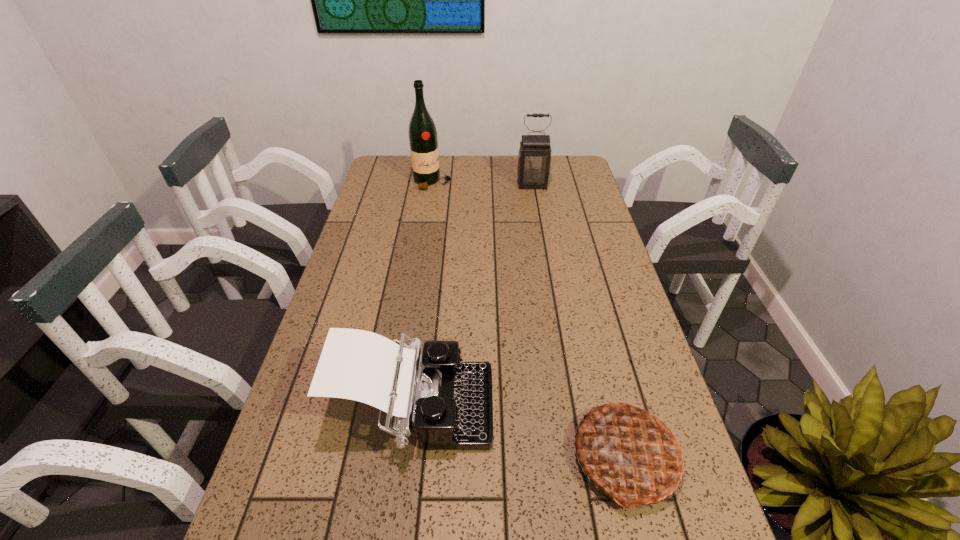
Image resolution: width=960 pixels, height=540 pixels. Find the location of `free space between the typewriter and the wine bottle`. free space between the typewriter and the wine bottle is located at coordinates pyautogui.click(x=423, y=296).

Locate an element on the screen. The width and height of the screenshot is (960, 540). the closest object to the tallest object is located at coordinates (534, 159).

Identify which object is the nearest to the typewriter. Please provide its 2D coordinates. Your answer should be formatted as a tuple, i.e. [(x, y)], where the tuple contains the x and y coordinates of a point satisfying the conditions above.

[(627, 451)]

Identify the location of vacant space that satisfies the following two spatial constraints: 1. on the keys of the pie; 2. on the right side of the typewriter. Image resolution: width=960 pixels, height=540 pixels. (409, 458).

I want to click on free space that satisfies the following two spatial constraints: 1. on the front-facing side of the lantern; 2. on the keys of the typewriter, so [x=571, y=410].

Where is `vacant point that satisfies the following two spatial constraints: 1. on the keys of the typewriter; 2. on the left side of the pie`? Image resolution: width=960 pixels, height=540 pixels. vacant point that satisfies the following two spatial constraints: 1. on the keys of the typewriter; 2. on the left side of the pie is located at coordinates (409, 458).

In order to click on vacant region that satisfies the following two spatial constraints: 1. on the front-facing side of the lantern; 2. on the left side of the pie in this screenshot , I will do `click(579, 458)`.